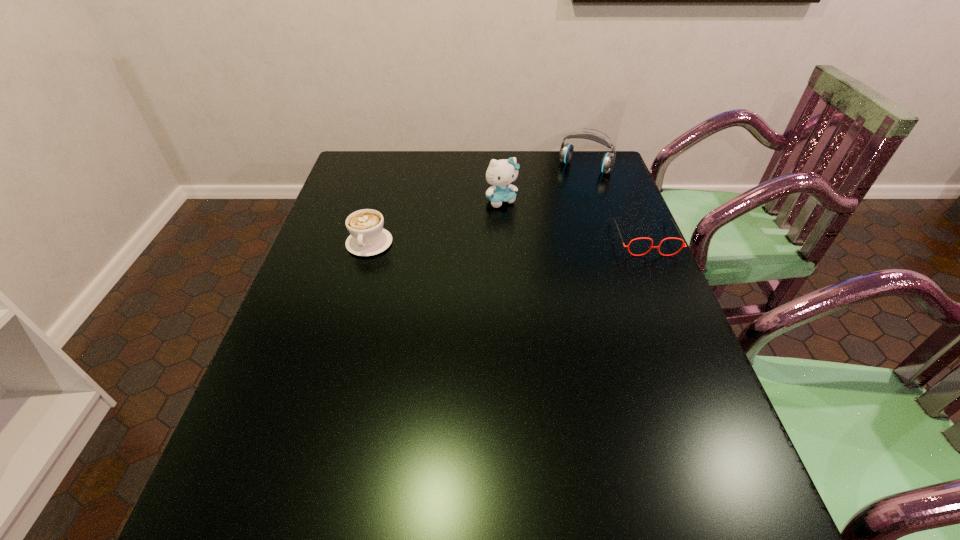
I want to click on free space between the kitten and the cappuccino, so click(x=436, y=222).

Find the location of a particular element. The image size is (960, 540). vacant area that lies between the cappuccino and the spectacles is located at coordinates (507, 241).

Locate an element on the screen. Image resolution: width=960 pixels, height=540 pixels. free space between the shortest object and the second farthest object is located at coordinates (573, 219).

The height and width of the screenshot is (540, 960). In order to click on free space between the farthest object and the third nearest object in this screenshot , I will do `click(543, 184)`.

Locate an element on the screen. Image resolution: width=960 pixels, height=540 pixels. vacant area between the cappuccino and the shortest object is located at coordinates (507, 241).

At what (x,y) coordinates should I click in order to perform the action: click on unoccupied area between the spectacles and the cappuccino. Please return your answer as a coordinate pair (x, y). This screenshot has height=540, width=960. Looking at the image, I should click on (507, 241).

At what (x,y) coordinates should I click in order to perform the action: click on object identified as the third closest to the shortest object. Please return your answer as a coordinate pair (x, y). The width and height of the screenshot is (960, 540). Looking at the image, I should click on (368, 237).

Identify which object is located as the second nearest to the spectacles. Please provide its 2D coordinates. Your answer should be formatted as a tuple, i.e. [(x, y)], where the tuple contains the x and y coordinates of a point satisfying the conditions above.

[(500, 173)]

The image size is (960, 540). Find the location of `free space in the image that satisfies the following two spatial constraints: 1. on the back side of the headset; 2. on the left side of the second object from left to right`. free space in the image that satisfies the following two spatial constraints: 1. on the back side of the headset; 2. on the left side of the second object from left to right is located at coordinates (499, 167).